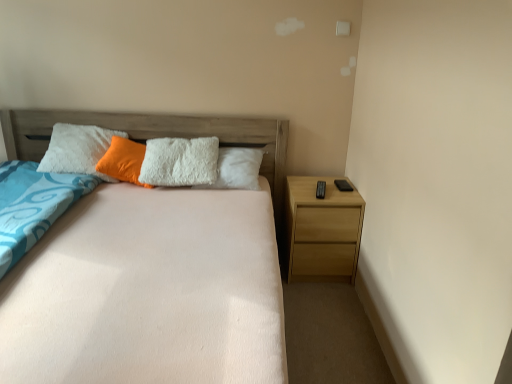
Question: Considering the relative sizes of light brown wood nightstand at right and orange fuzzy pillow at center in the image provided, is light brown wood nightstand at right bigger than orange fuzzy pillow at center?

Choices:
 (A) no
 (B) yes

Answer: (B)

Question: Are light brown wood nightstand at right and orange fuzzy pillow at center located far from each other?

Choices:
 (A) yes
 (B) no

Answer: (A)

Question: Is light brown wood nightstand at right facing towards orange fuzzy pillow at center?

Choices:
 (A) yes
 (B) no

Answer: (B)

Question: Considering the relative sizes of light brown wood nightstand at right and orange fuzzy pillow at center in the image provided, is light brown wood nightstand at right thinner than orange fuzzy pillow at center?

Choices:
 (A) no
 (B) yes

Answer: (A)

Question: Would you say orange fuzzy pillow at center is part of light brown wood nightstand at right's contents?

Choices:
 (A) yes
 (B) no

Answer: (B)

Question: Looking at the image, does peach soft fabric bed at center seem bigger or smaller compared to light brown wood nightstand at right?

Choices:
 (A) big
 (B) small

Answer: (A)

Question: From the image's perspective, is peach soft fabric bed at center above or below light brown wood nightstand at right?

Choices:
 (A) above
 (B) below

Answer: (B)

Question: Based on their positions, is peach soft fabric bed at center located to the left or right of light brown wood nightstand at right?

Choices:
 (A) right
 (B) left

Answer: (B)

Question: Considering the positions of peach soft fabric bed at center and light brown wood nightstand at right in the image, is peach soft fabric bed at center wider or thinner than light brown wood nightstand at right?

Choices:
 (A) wide
 (B) thin

Answer: (A)

Question: Would you say light brown wood nightstand at right is inside or outside peach soft fabric bed at center?

Choices:
 (A) inside
 (B) outside

Answer: (B)

Question: Considering their positions, is light brown wood nightstand at right located in front of or behind peach soft fabric bed at center?

Choices:
 (A) front
 (B) behind

Answer: (B)

Question: From the image's perspective, is light brown wood nightstand at right located above or below peach soft fabric bed at center?

Choices:
 (A) above
 (B) below

Answer: (A)

Question: Would you say light brown wood nightstand at right is to the left or to the right of peach soft fabric bed at center in the picture?

Choices:
 (A) right
 (B) left

Answer: (A)

Question: Relative to orange fuzzy pillow at center, is peach soft fabric bed at center in front or behind?

Choices:
 (A) behind
 (B) front

Answer: (B)

Question: From a real-world perspective, relative to orange fuzzy pillow at center, is peach soft fabric bed at center vertically above or below?

Choices:
 (A) below
 (B) above

Answer: (A)